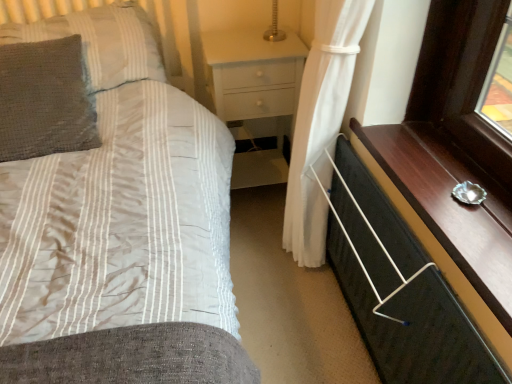
Question: Looking at the image, does gray textured pillow at left, which ranks as the 2th pillow in top-to-bottom order, seem bigger or smaller compared to white glossy nightstand at center?

Choices:
 (A) small
 (B) big

Answer: (A)

Question: Considering the positions of gray textured pillow at left, which ranks as the 2th pillow in top-to-bottom order, and white glossy nightstand at center in the image, is gray textured pillow at left, which ranks as the 2th pillow in top-to-bottom order, wider or thinner than white glossy nightstand at center?

Choices:
 (A) thin
 (B) wide

Answer: (A)

Question: Based on their relative distances, which object is nearer to the white glossy nightstand at center?

Choices:
 (A) white fabric curtain at lower right
 (B) gray textured pillow at upper left, arranged as the 1th pillow when viewed from the top
 (C) matte striped fabric bed at center
 (D) gray textured pillow at left, which ranks as the 2th pillow in top-to-bottom order
 (E) black fabric chest of drawers at lower right

Answer: (B)

Question: Estimate the real-world distances between objects in this image. Which object is farther from the gray textured pillow at upper left, positioned as the second pillow in bottom-to-top order?

Choices:
 (A) gray textured pillow at left, acting as the first pillow starting from the bottom
 (B) black fabric chest of drawers at lower right
 (C) white fabric curtain at lower right
 (D) matte striped fabric bed at center
 (E) white glossy nightstand at center

Answer: (B)